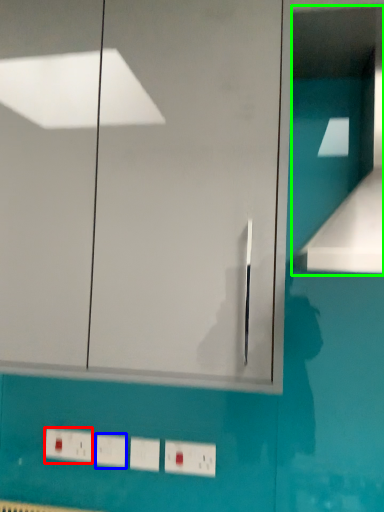
Question: Which is nearer to the electric outlet (highlighted by a red box)? light switch (highlighted by a blue box) or vent (highlighted by a green box).

Choices:
 (A) light switch
 (B) vent

Answer: (A)